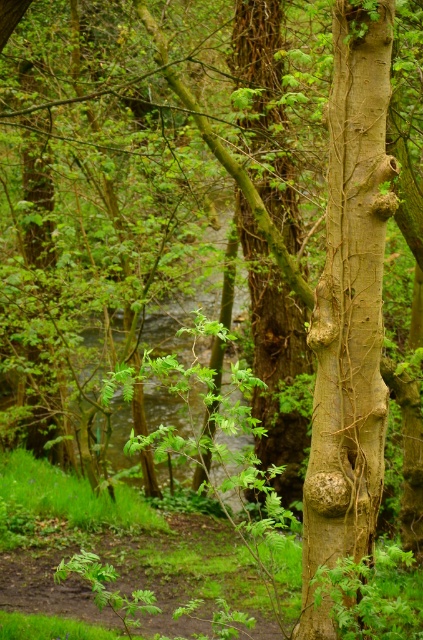
You are a hiker who wants to cross the stream. You see the smooth brown bark at right and the green rough bark tree trunk at center. Which object is located to the right of the other?

The smooth brown bark at right is positioned on the right side of green rough bark tree trunk at center.

You are a hiker carrying a 5 meter long rope. You want to tie the smooth brown bark at right to the green rough bark tree trunk at center. Can your rope reach between them?

The smooth brown bark at right and green rough bark tree trunk at center are 4.66 meters apart. Since the rope is 5 meters long, it can easily reach between them.

In the scene shown: You are a hiker who has stumbled upon this forest scene. You notice the smooth brown bark at right and the green rough bark tree trunk at center. Which of these two objects is located closer to the ground?

The smooth brown bark at right is positioned under the green rough bark tree trunk at center, so it is closer to the ground.